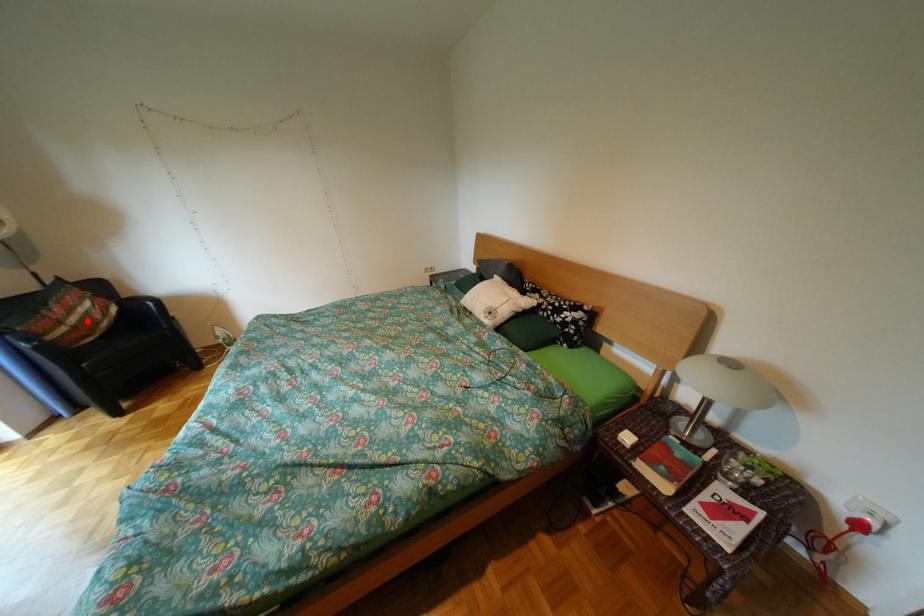
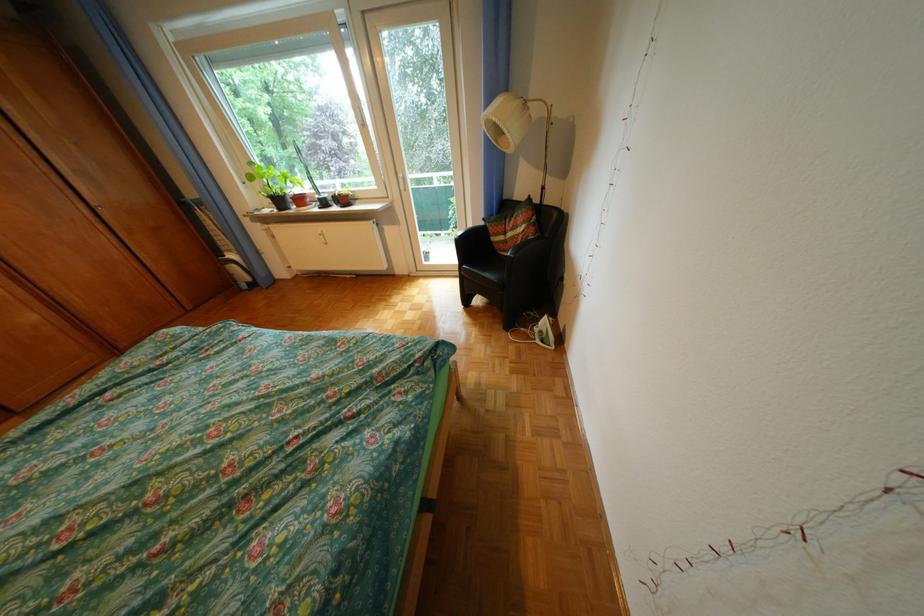
Question: I am providing you with two images of the same scene from different viewpoints. In image1, a red point is highlighted. Considering the same 3D point in image2, which of the following is correct?

Choices:
 (A) It is closer
 (B) It is farther

Answer: (A)